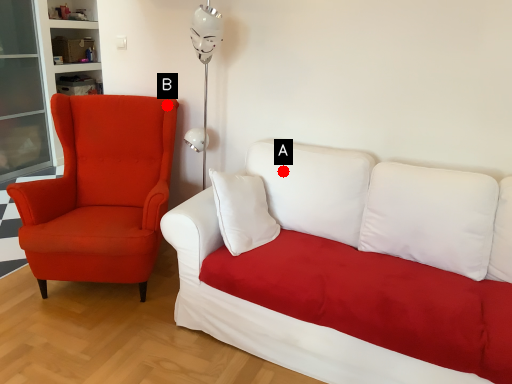
Question: Two points are circled on the image, labeled by A and B beside each circle. Which of the following is the closest to the observer?

Choices:
 (A) A is closer
 (B) B is closer

Answer: (A)